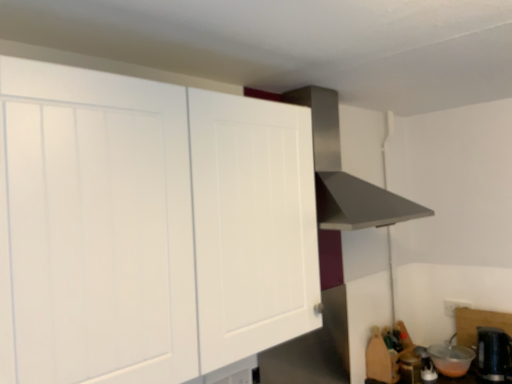
Question: Is the depth of black plastic kettle at lower right, the fourth appliance positioned from the left, greater than that of metallic silver toaster at lower right, placed as the first appliance when sorted from left to right?

Choices:
 (A) no
 (B) yes

Answer: (A)

Question: From a real-world perspective, is black plastic kettle at lower right, which ranks as the 1th appliance in right-to-left order, on top of metallic silver toaster at lower right, which is the 4th appliance in right-to-left order?

Choices:
 (A) no
 (B) yes

Answer: (B)

Question: Can you confirm if black plastic kettle at lower right, which ranks as the 1th appliance in right-to-left order, is positioned to the right of metallic silver toaster at lower right, which is the 4th appliance in right-to-left order?

Choices:
 (A) no
 (B) yes

Answer: (B)

Question: Considering the relative sizes of black plastic kettle at lower right, which ranks as the 1th appliance in right-to-left order, and metallic silver toaster at lower right, which is the 4th appliance in right-to-left order, in the image provided, is black plastic kettle at lower right, which ranks as the 1th appliance in right-to-left order, shorter than metallic silver toaster at lower right, which is the 4th appliance in right-to-left order,?

Choices:
 (A) no
 (B) yes

Answer: (A)

Question: Can you confirm if black plastic kettle at lower right, which ranks as the 1th appliance in right-to-left order, is taller than metallic silver toaster at lower right, which is the 4th appliance in right-to-left order?

Choices:
 (A) no
 (B) yes

Answer: (B)

Question: From a real-world perspective, is transparent plastic bowl at lower right, the 2th appliance viewed from the right, above or below white matte cabinet at upper left?

Choices:
 (A) above
 (B) below

Answer: (B)

Question: Is transparent plastic bowl at lower right, which appears as the third appliance when viewed from the left, wider or thinner than white matte cabinet at upper left?

Choices:
 (A) wide
 (B) thin

Answer: (B)

Question: Is transparent plastic bowl at lower right, the 2th appliance viewed from the right, bigger or smaller than white matte cabinet at upper left?

Choices:
 (A) big
 (B) small

Answer: (B)

Question: Considering the positions of point (430, 352) and point (260, 301), is point (430, 352) closer or farther from the camera than point (260, 301)?

Choices:
 (A) farther
 (B) closer

Answer: (A)

Question: Is black plastic kettle at lower right, the fourth appliance positioned from the left, inside the boundaries of metallic silver toaster at lower right, which is the 4th appliance in right-to-left order, or outside?

Choices:
 (A) inside
 (B) outside

Answer: (B)

Question: From the image's perspective, is black plastic kettle at lower right, which ranks as the 1th appliance in right-to-left order, positioned above or below metallic silver toaster at lower right, placed as the first appliance when sorted from left to right?

Choices:
 (A) below
 (B) above

Answer: (B)

Question: Based on their sizes in the image, would you say black plastic kettle at lower right, which ranks as the 1th appliance in right-to-left order, is bigger or smaller than metallic silver toaster at lower right, which is the 4th appliance in right-to-left order?

Choices:
 (A) small
 (B) big

Answer: (B)

Question: From a real-world perspective, is black plastic kettle at lower right, the fourth appliance positioned from the left, above or below metallic silver toaster at lower right, placed as the first appliance when sorted from left to right?

Choices:
 (A) below
 (B) above

Answer: (B)

Question: Is white matte cabinet at upper left spatially inside transparent plastic bowl at lower right, which appears as the third appliance when viewed from the left, or outside of it?

Choices:
 (A) inside
 (B) outside

Answer: (B)

Question: From the image's perspective, is white matte cabinet at upper left positioned above or below transparent plastic bowl at lower right, the 2th appliance viewed from the right?

Choices:
 (A) below
 (B) above

Answer: (B)